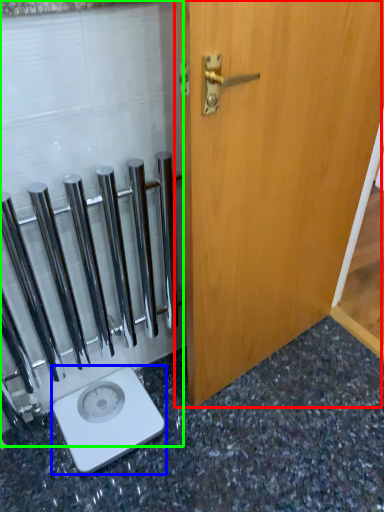
Question: Which object is the closest to the door (highlighted by a red box)? Choose among these: scale (highlighted by a blue box) or glass door (highlighted by a green box).

Choices:
 (A) scale
 (B) glass door

Answer: (B)